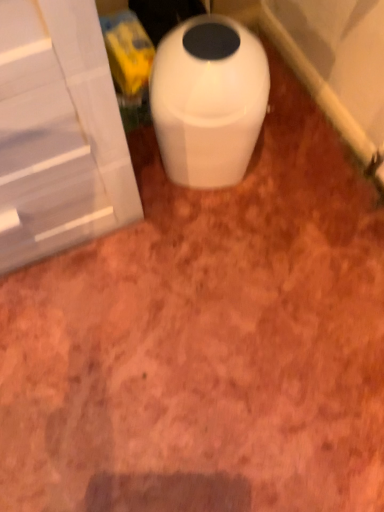
This screenshot has width=384, height=512. Identify the location of vacant area that is in front of white glossy screen door at left. (92, 331).